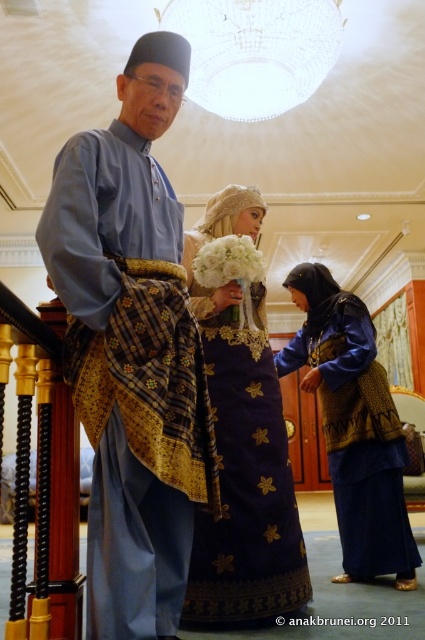
Question: Is matte blue shirt at center smaller than blue textured fabric dress at lower right?

Choices:
 (A) yes
 (B) no

Answer: (A)

Question: Does matte blue shirt at center have a lesser width compared to blue silk dress at center?

Choices:
 (A) no
 (B) yes

Answer: (B)

Question: Which is farther from the blue silk dress at center?

Choices:
 (A) blue textured fabric dress at lower right
 (B) matte blue shirt at center

Answer: (B)

Question: Which point is farther from the camera taking this photo?

Choices:
 (A) (263, 516)
 (B) (401, 488)

Answer: (B)

Question: Does matte blue shirt at center appear over blue textured fabric dress at lower right?

Choices:
 (A) no
 (B) yes

Answer: (B)

Question: Which of the following is the closest to the observer?

Choices:
 (A) blue silk dress at center
 (B) matte blue shirt at center
 (C) blue textured fabric dress at lower right

Answer: (B)